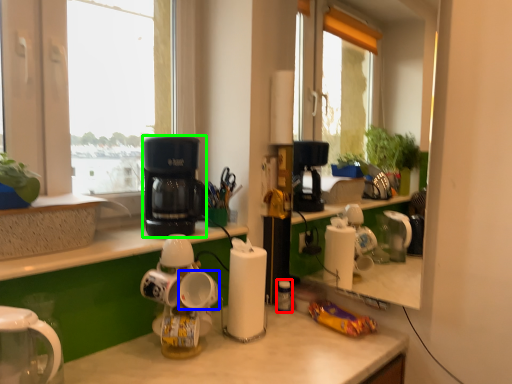
Question: Which is nearer to the bottle (highlighted by a red box)? mug (highlighted by a blue box) or kitchen appliance (highlighted by a green box).

Choices:
 (A) mug
 (B) kitchen appliance

Answer: (A)